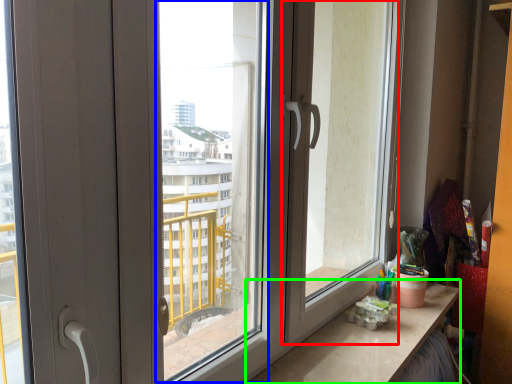
Question: Which is nearer to the screen door (highlighted by a red box)? window screen (highlighted by a blue box) or counter top (highlighted by a green box).

Choices:
 (A) window screen
 (B) counter top

Answer: (B)